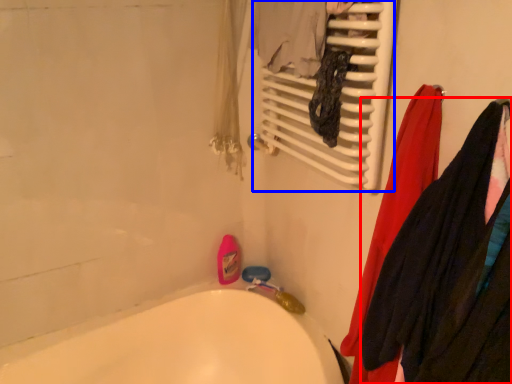
Question: Which object appears farthest to the camera in this image, clothing (highlighted by a red box) or radiator (highlighted by a blue box)?

Choices:
 (A) clothing
 (B) radiator

Answer: (B)